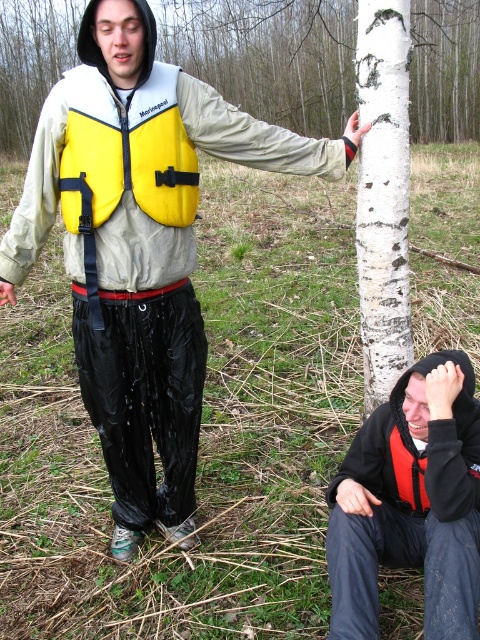
Looking at this image, you are a hiker carrying a backpack that is 1 meter wide. You want to pass between the yellow matte life jacket at center and the red matte life jacket at lower right. Can your backpack fit through the space between them?

The distance between the yellow matte life jacket at center and the red matte life jacket at lower right is 1.15 meters. Since your backpack is 1 meter wide, it can fit through the space between them as the distance is wider than the backpack.